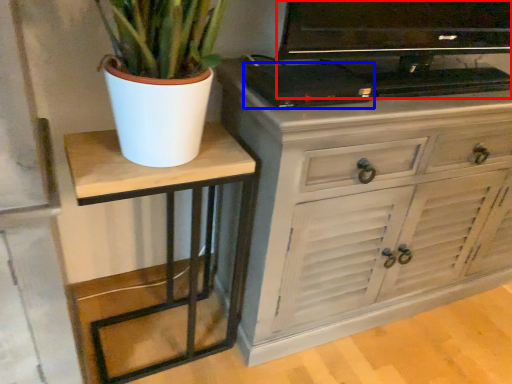
Question: Which object is further to the camera taking this photo, television (highlighted by a red box) or appliance (highlighted by a blue box)?

Choices:
 (A) television
 (B) appliance

Answer: (B)